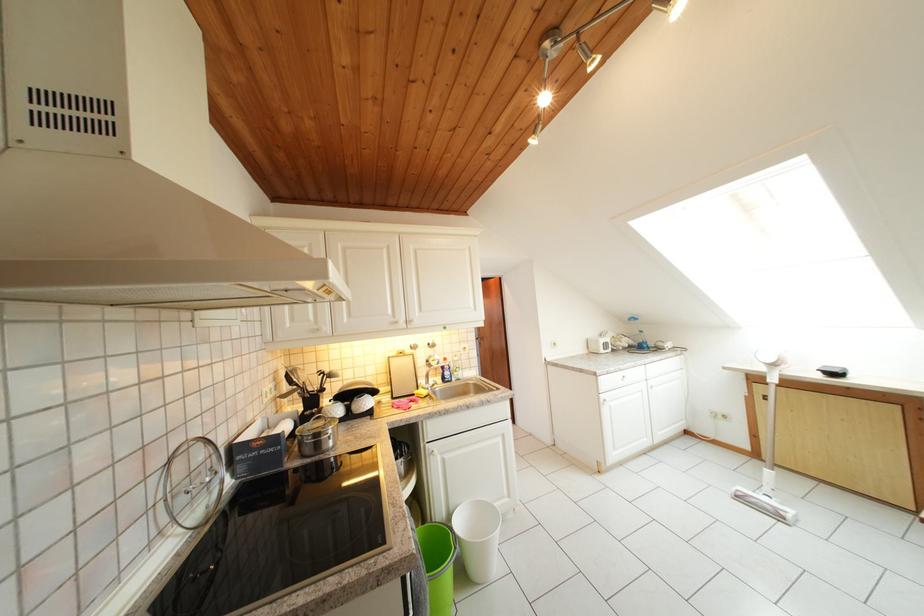
Locate an element on the screen. The image size is (924, 616). silver faucet handle is located at coordinates (435, 454).